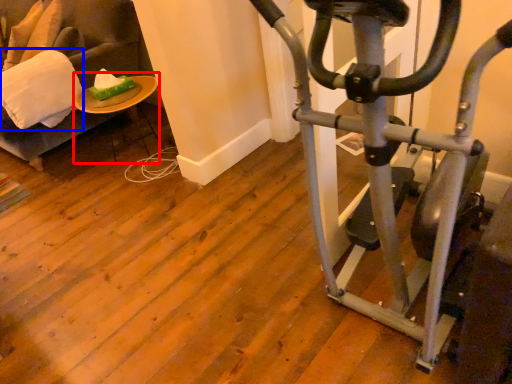
Question: Which object is further to the camera taking this photo, table (highlighted by a red box) or pillow (highlighted by a blue box)?

Choices:
 (A) table
 (B) pillow

Answer: (A)